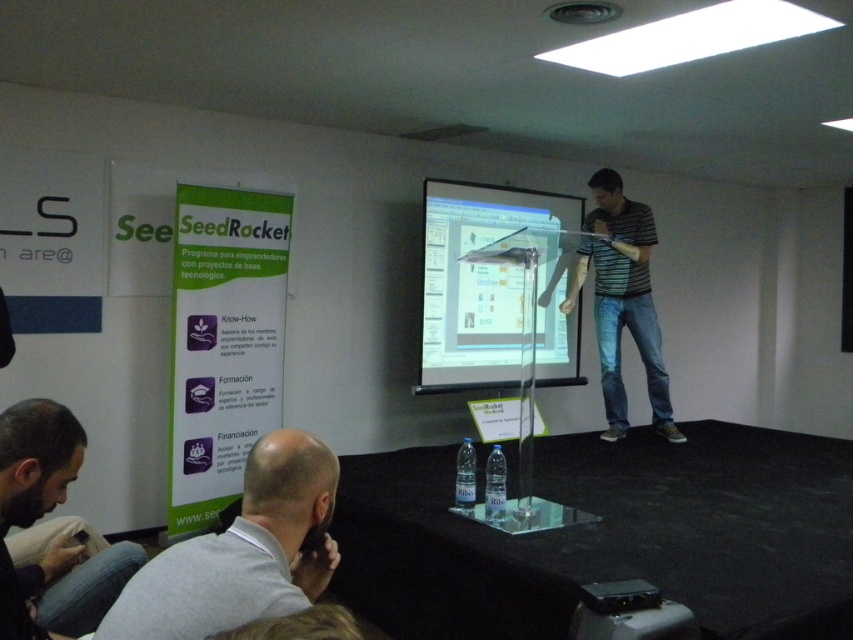
You are an attendee sitting in the front row of the presentation. You notice the transparent glass projection screen at center and the dark brown leather jacket at lower left. Which object is closer to you?

The transparent glass projection screen at center is closer to you than the dark brown leather jacket at lower left because it is further to the viewer.

You are attending a presentation and want to take a photo of the slide on the screen. The speaker is using a pointer to highlight a key point on the slide. The point he is pointing at is located at coordinates point (265, 496). If the distance from the camera to this point is 4.51 feet, will you be able to capture the entire slide in your photo without zooming in?

The point (265, 496) is 4.51 feet away from the camera, so if the camera has a wide enough angle or the photographer is positioned to include the entire slide within the frame, it might be possible. However, without knowing the camera specifications or the slide size, it is hard to determine for sure.